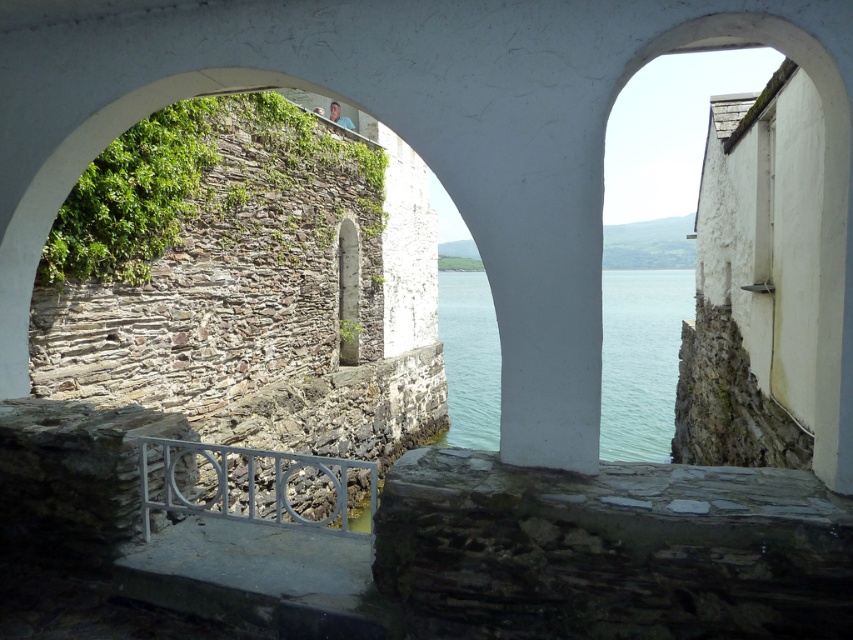
Which is more to the right, clear water at center or metallic gray railing at lower center?

clear water at center

Can you confirm if clear water at center is positioned to the right of metallic gray railing at lower center?

Indeed, clear water at center is positioned on the right side of metallic gray railing at lower center.

Who is more forward, (x=628, y=360) or (x=225, y=465)?

Point (x=225, y=465)

Locate an element on the screen. This screenshot has width=853, height=640. clear water at center is located at coordinates (641, 358).